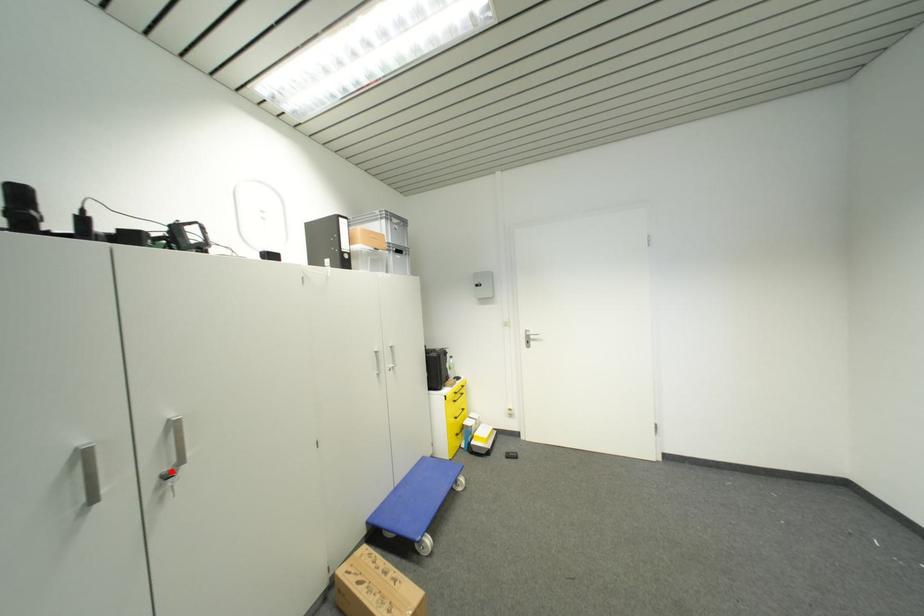
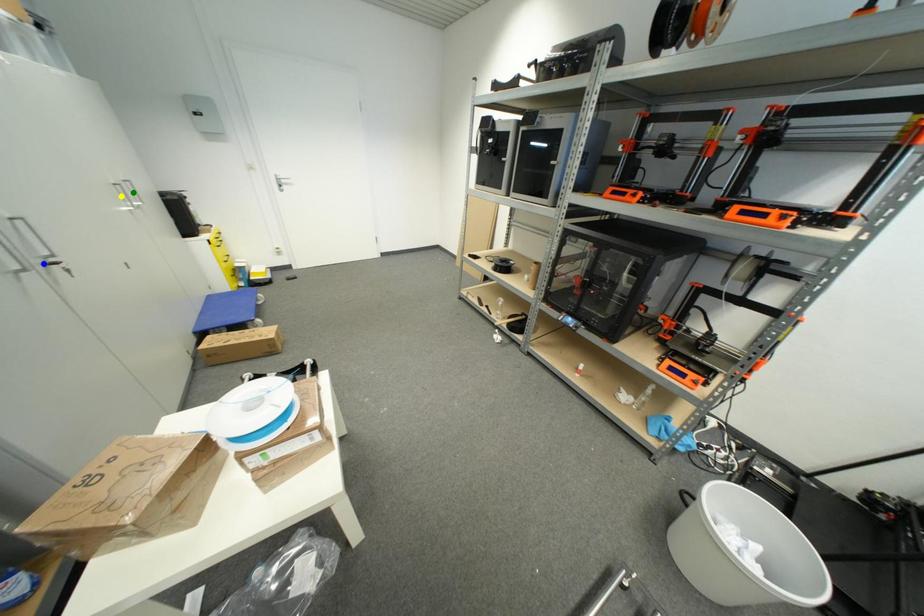
Question: I am providing you with two images of the same scene from different viewpoints. A red point is marked on the first image. You are given multiple points on the second image. In image 2, which mark is for the same physical point as the one in image 1?

Choices:
 (A) yellow point
 (B) green point
 (C) blue point

Answer: (C)